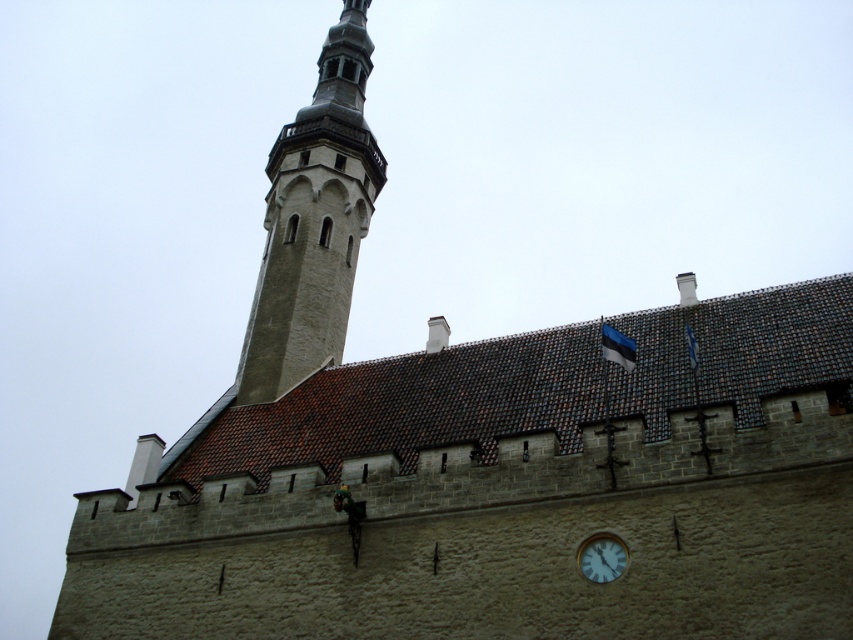
Describe the element at coordinates (312, 221) in the screenshot. I see `smooth stone tower at upper left` at that location.

Is point (318, 278) farther from camera compared to point (607, 573)?

Yes, it is.

Find the location of `smooth stone tower at upper left`. smooth stone tower at upper left is located at coordinates (312, 221).